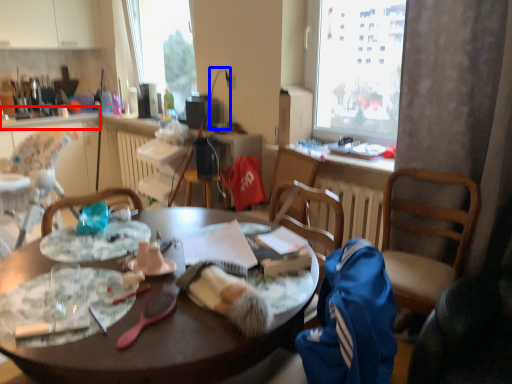
Question: Which point is further to the camera, counter top (highlighted by a red box) or lamp (highlighted by a blue box)?

Choices:
 (A) counter top
 (B) lamp

Answer: (A)